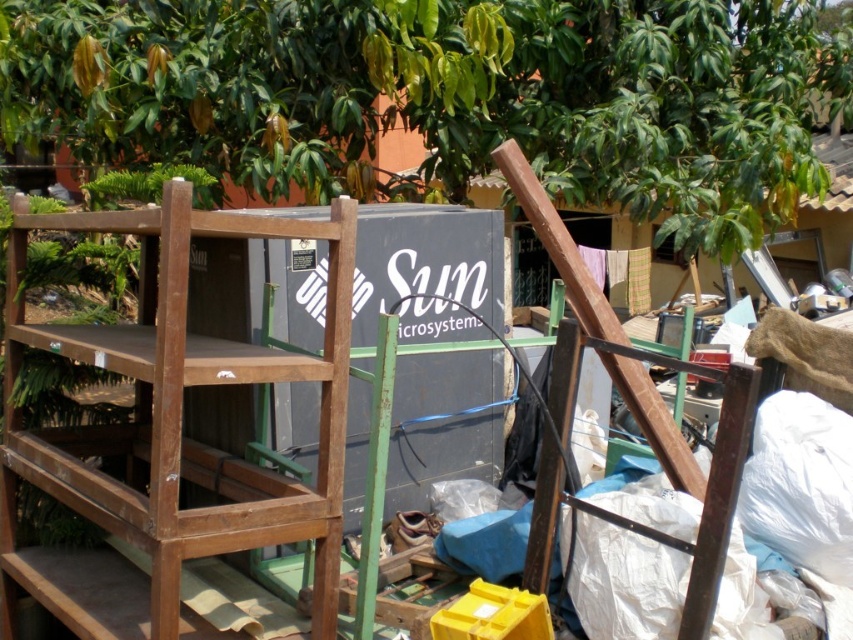
You are trying to fit a new piece of furniture into this storage area. You have a brown wooden bunk bed at center and a wooden at right. Which one has more space available on its right side for placing additional items?

The brown wooden bunk bed at center might be wider than wooden at right, so it likely has more space available on its right side for placing additional items.

You are standing in the storage area and want to move the wooden at right to the left side of the green leafy tree at upper center. Is this possible based on their current positions?

The green leafy tree at upper center is already to the left of wooden at right, so moving the wooden at right further to the left would place it closer to the tree, making it possible to position it to the left side of the green leafy tree at upper center.